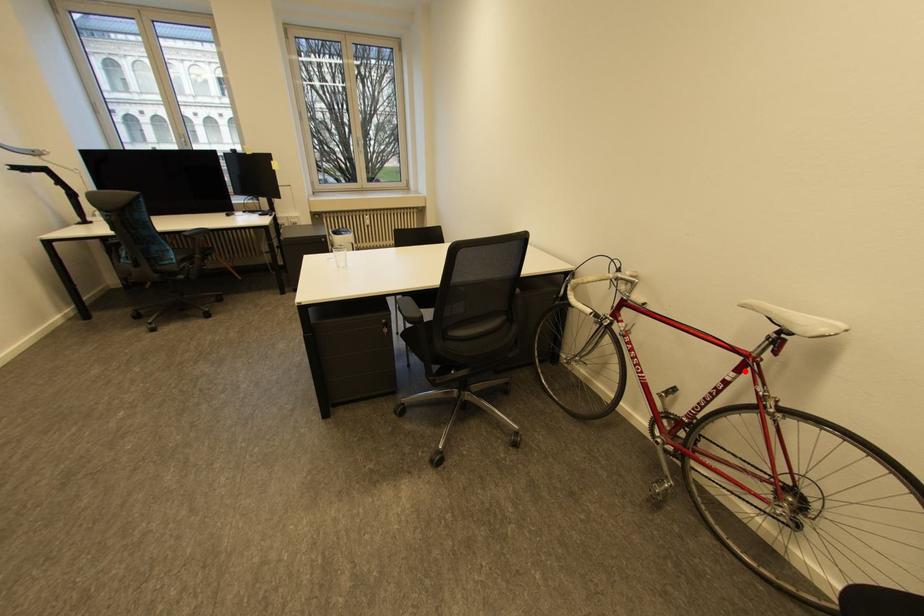
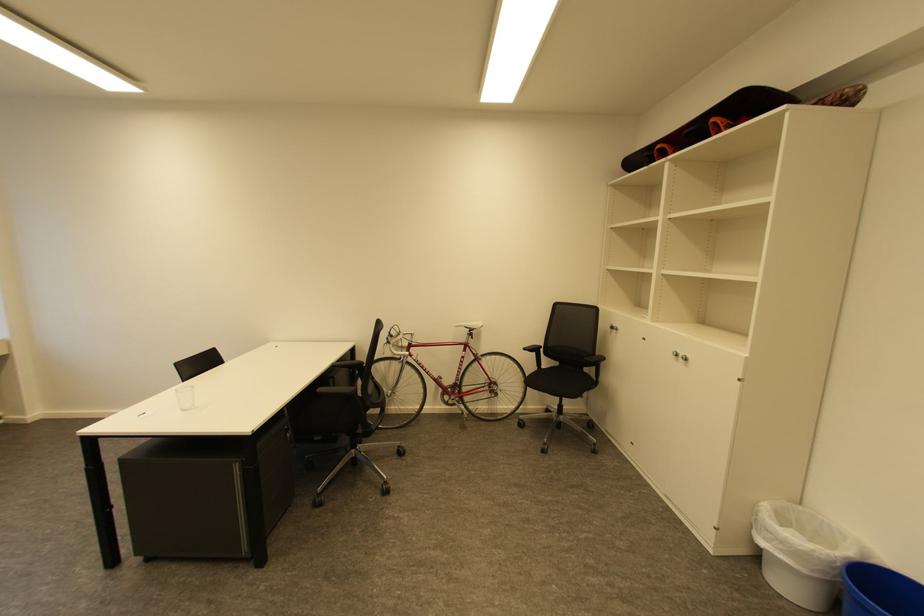
The point at the highlighted location is marked in the first image. Where is the corresponding point in the second image?

(471, 351)